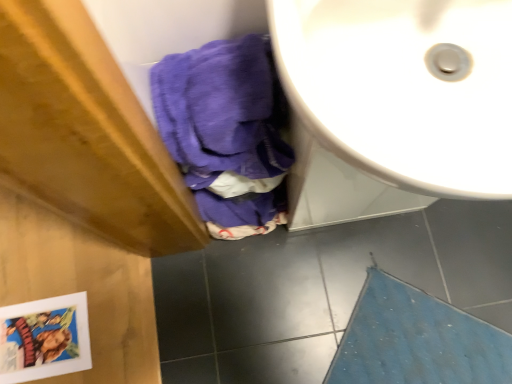
Locate an element on the screen. free space above blue textured bath mat at lower right (from a real-world perspective) is located at coordinates (x=417, y=348).